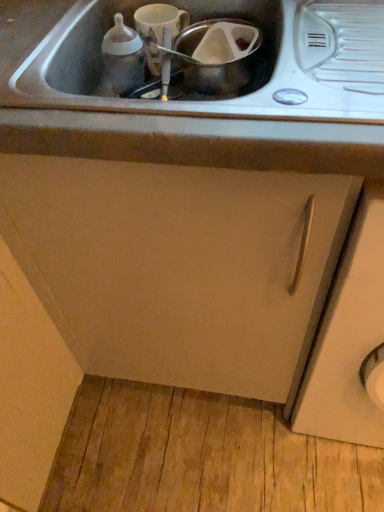
Question: In terms of height, does white matte cabinet door at center-right, the 2th cabinetry when ordered from left to right, look taller or shorter compared to metallic stainless steel sink at center, the second sink positioned from the front?

Choices:
 (A) tall
 (B) short

Answer: (A)

Question: Is point (321, 384) closer or farther from the camera than point (269, 24)?

Choices:
 (A) closer
 (B) farther

Answer: (B)

Question: Which is nearer to the stainless steel sink at upper center, the 1th sink viewed from the front?

Choices:
 (A) white matte cabinet door at center-right, the 2th cabinetry when ordered from left to right
 (B) transparent plastic container at center, the 1th appliance in the right-to-left sequence
 (C) matte plastic bottle at upper left
 (D) metallic stainless steel sink at center, the first sink when ordered from back to front
 (E) matte white cup at upper center, marked as the second appliance in a right-to-left arrangement

Answer: (D)

Question: Which of these objects is positioned closest to the matte white cabinet at center, which ranks as the first cabinetry in left-to-right order?

Choices:
 (A) white matte cabinet door at center-right, the 1th cabinetry positioned from the right
 (B) stainless steel sink at upper center, which ranks as the second sink in back-to-front order
 (C) transparent plastic container at center, which appears as the second appliance when viewed from the left
 (D) matte plastic bottle at upper left
 (E) matte white cup at upper center, the first appliance when ordered from left to right

Answer: (A)